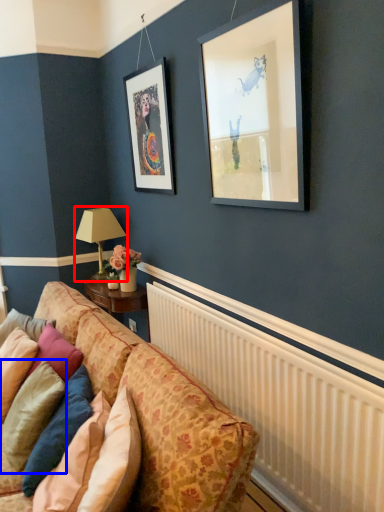
Question: Which of the following is the farthest to the observer, table lamp (highlighted by a red box) or pillow (highlighted by a blue box)?

Choices:
 (A) table lamp
 (B) pillow

Answer: (A)